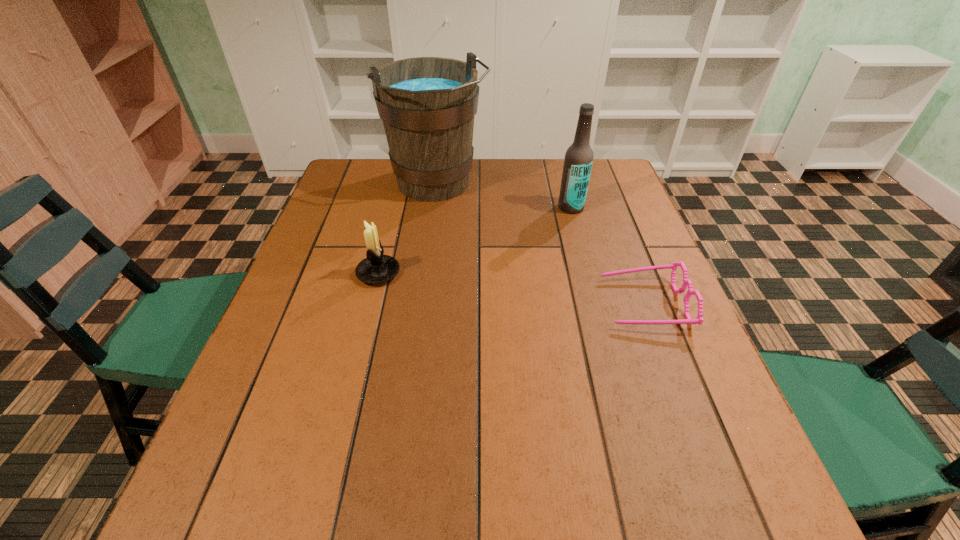
Where is `free space between the tallest object and the third shortest object`? The width and height of the screenshot is (960, 540). free space between the tallest object and the third shortest object is located at coordinates (505, 196).

Locate an element on the screen. The width and height of the screenshot is (960, 540). vacant area between the second tallest object and the spectacles is located at coordinates (608, 255).

This screenshot has height=540, width=960. Identify the location of free space between the beer bottle and the candle holder. (474, 240).

This screenshot has height=540, width=960. In order to click on vacant space in between the beer bottle and the second shortest object in this screenshot , I will do `click(474, 240)`.

Where is `free area in between the candle holder and the second tallest object`? The height and width of the screenshot is (540, 960). free area in between the candle holder and the second tallest object is located at coordinates (474, 240).

I want to click on free space between the wine bucket and the second tallest object, so click(505, 196).

This screenshot has width=960, height=540. Identify the location of object that is the second closest one to the candle holder. (578, 160).

The height and width of the screenshot is (540, 960). What are the coordinates of `object that is the second closest one to the beer bottle` in the screenshot? It's located at (699, 319).

The width and height of the screenshot is (960, 540). In order to click on free space in the image that satisfies the following two spatial constraints: 1. on the front side of the third shortest object; 2. on the arms of the spectacles in this screenshot , I will do `click(596, 303)`.

What are the coordinates of `free location that satisfies the following two spatial constraints: 1. on the back side of the third tallest object; 2. on the right side of the third shortest object` in the screenshot? It's located at (395, 207).